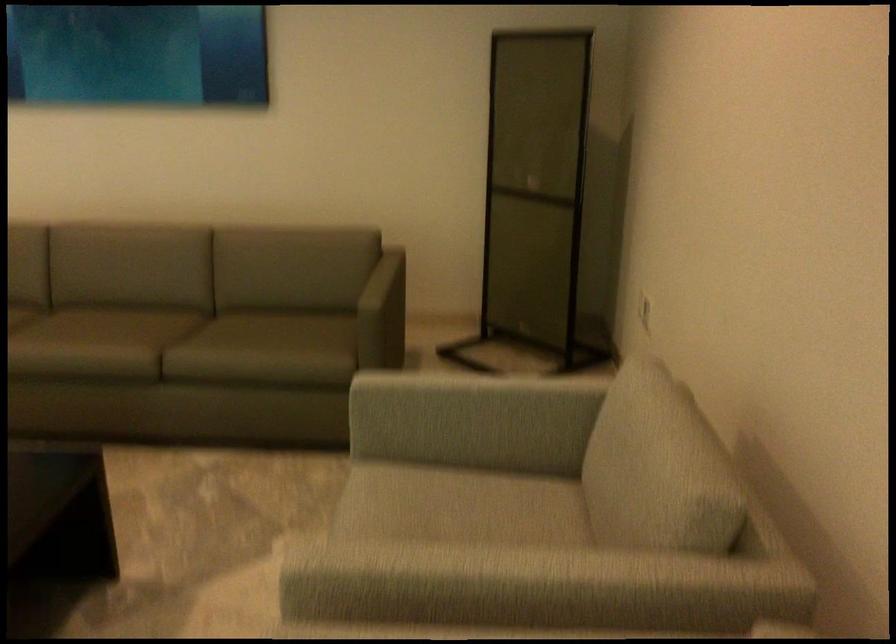
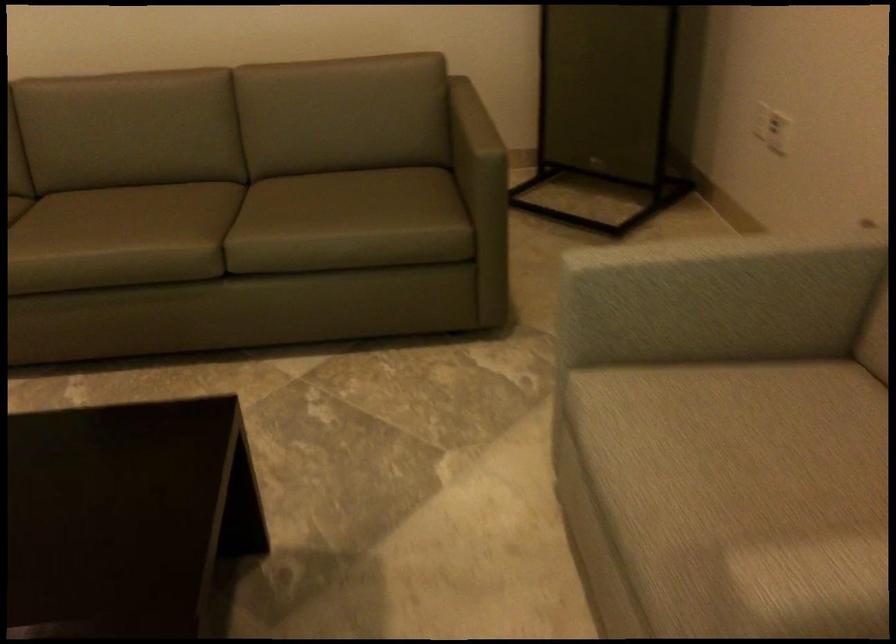
What movement of the cameraman would produce the second image?

The cameraman walked toward left, forward.